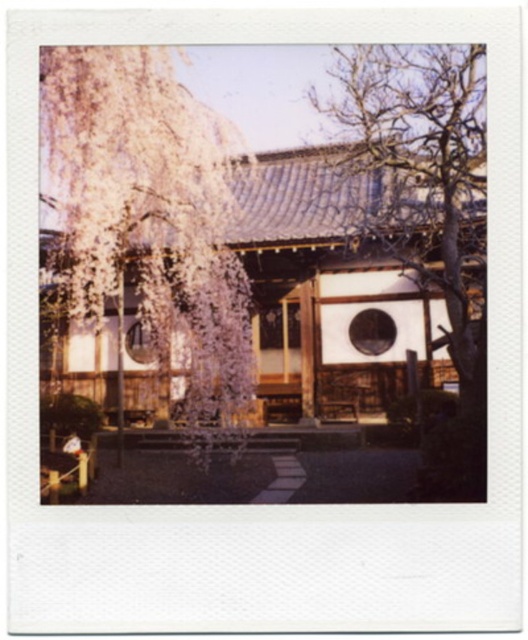
Is point (73, 92) positioned before point (363, 212)?

Yes, it is in front of point (363, 212).

Between white silky tree at upper left and bare wood tree at right, which one has more height?

bare wood tree at right is taller.

Which is behind, point (152, 168) or point (376, 120)?

Point (152, 168)

At what (x,y) coordinates should I click in order to perform the action: click on white silky tree at upper left. Please return your answer as a coordinate pair (x, y). Image resolution: width=528 pixels, height=640 pixels. Looking at the image, I should click on click(x=150, y=216).